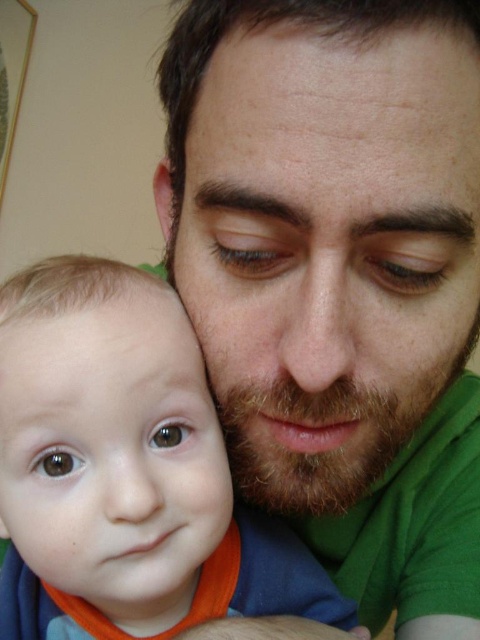
You are a photographer adjusting the lighting for a photo shoot. You need to ensure that the green matte shirt at center and the smooth orange bib at lower left are both well lit. Given that the lighting equipment can cover an area of 10 centimeters in diameter, will the current setup adequately illuminate both objects without moving the lights?

The distance between the green matte shirt at center and the smooth orange bib at lower left is 9.65 centimeters, which is within the 10 centimeter coverage of the lighting equipment. Therefore, the current setup can adequately illuminate both objects without moving the lights.

In the scene shown: You are a photographer trying to capture a close shot of the man and child. You need to ensure that both the smooth orange bib at lower left and the smooth skin forehead at upper center are in focus. Given that your camera can only focus on objects within a 6 inch range, will both objects be in focus?

Result: The distance between the smooth orange bib at lower left and the smooth skin forehead at upper center is 7.42 inches. Since the camera can only focus within a 6 inch range, the objects are too far apart to both be in focus simultaneously.

You are a photographer adjusting the focus of your camera. You need to ensure that the green matte shirt at center is in sharp focus. What coordinates should you set the focus point to?

The green matte shirt at center should be focused at coordinates point (338, 278).